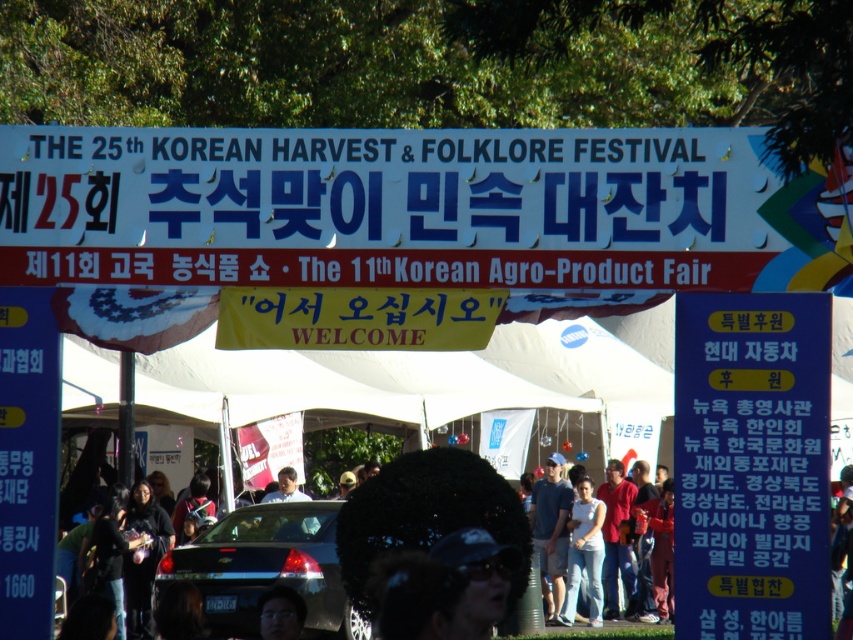
You are a visitor standing at the entrance of the festival. You see the white plastic banner at upper center and the blue paper sign at center. Which object is positioned higher?

The white plastic banner at upper center is positioned higher than the blue paper sign at center.

You are a photographer standing at the entrance of the festival. You want to take a photo that includes both the white plastic banner at upper center and the white cotton shirt at center. Since the banner is larger, will it cover the shirt in the photo?

The white plastic banner at upper center is larger than the white cotton shirt at center, so it might cover part of the shirt depending on the angle and distance. To ensure both are visible, adjust your position to avoid overlap.

You are a visitor approaching the entrance of the festival. You notice the white plastic banner at upper center and the blue paper sign at center. Which object is positioned closer to you as you walk towards the entrance?

The white plastic banner at upper center is closer to the viewer than the blue paper sign at center, so the white plastic banner at upper center is positioned closer to you as you walk towards the entrance.